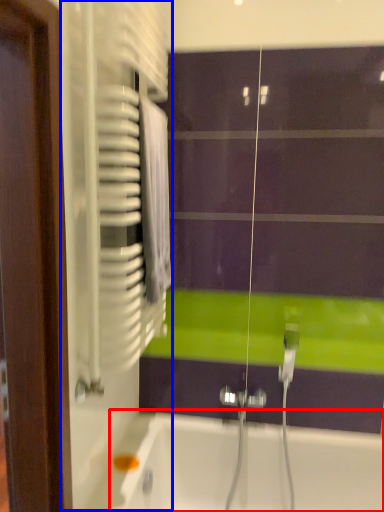
Question: Among these objects, which one is farthest to the camera, bathtub (highlighted by a red box) or screen door (highlighted by a blue box)?

Choices:
 (A) bathtub
 (B) screen door

Answer: (A)